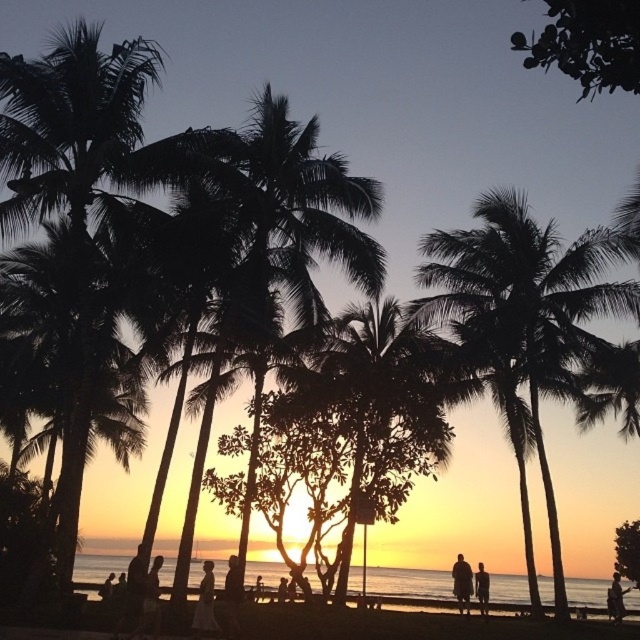
Question: Is silhouette coconut palm at center below white cotton dress at center?

Choices:
 (A) no
 (B) yes

Answer: (A)

Question: Can you confirm if silhouette leafy palm at left is positioned below silhouette coconut palm at center?

Choices:
 (A) yes
 (B) no

Answer: (B)

Question: Can you confirm if silhouette leafy palm at left is bigger than smooth skin person at lower right?

Choices:
 (A) yes
 (B) no

Answer: (A)

Question: Which point is farther to the camera?

Choices:
 (A) (212, 589)
 (B) (140, 131)
 (C) (280, 588)

Answer: (C)

Question: Which point is closer to the camera?

Choices:
 (A) silhouette coconut palm at center
 (B) white cotton dress at center

Answer: (A)

Question: Estimate the real-world distances between objects in this image. Which object is closer to the silhouette coconut palm at center?

Choices:
 (A) smooth skin person at center
 (B) silhouette leafy palm tree at center

Answer: (A)